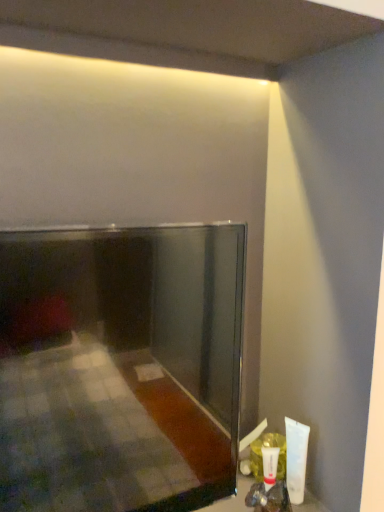
Question: Should I look upward or downward to see matte black mirror at center?

Choices:
 (A) up
 (B) down

Answer: (B)